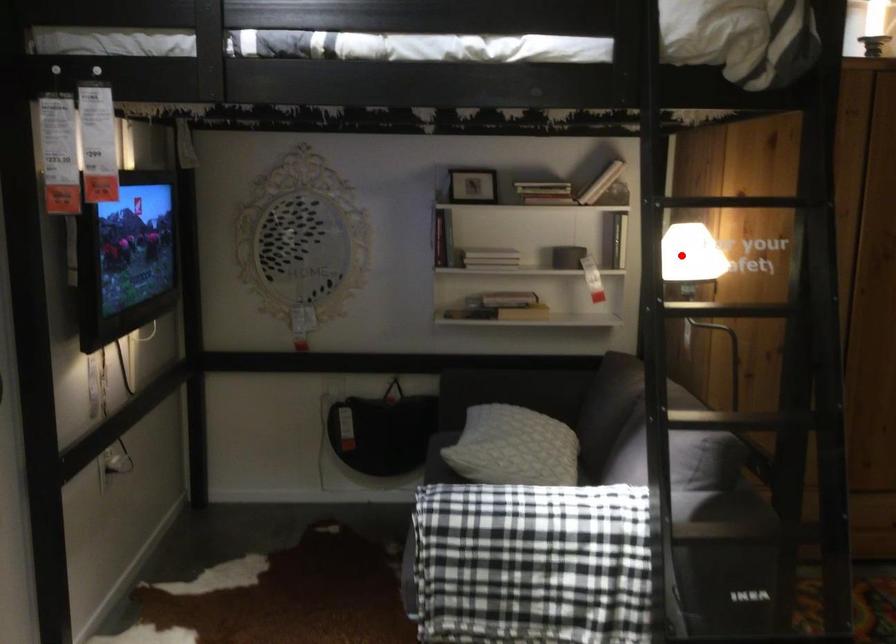
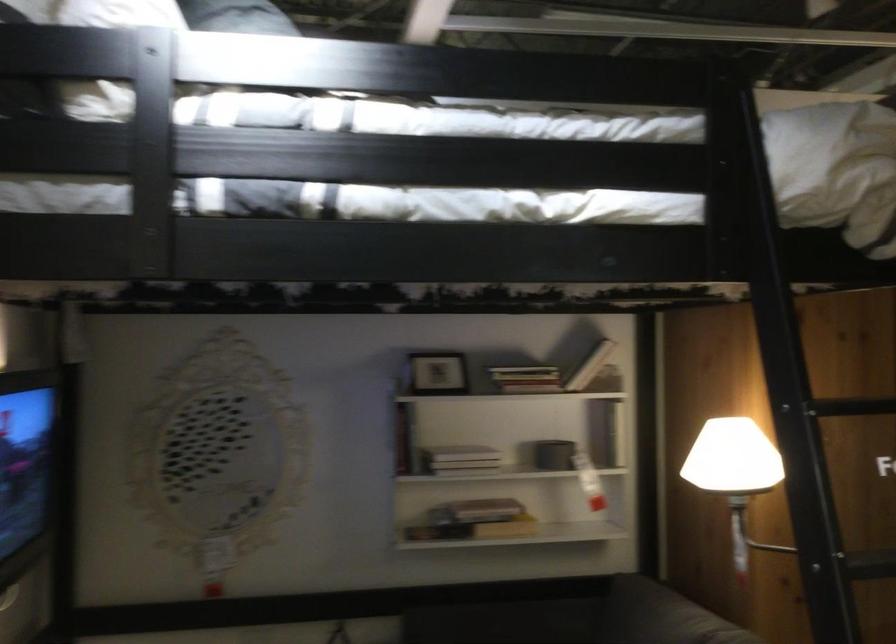
Question: I am providing you with two images of the same scene from different viewpoints. Given a red point in image1, look at the same physical point in image2. Is it:

Choices:
 (A) Closer to the viewpoint
 (B) Farther from the viewpoint

Answer: (A)